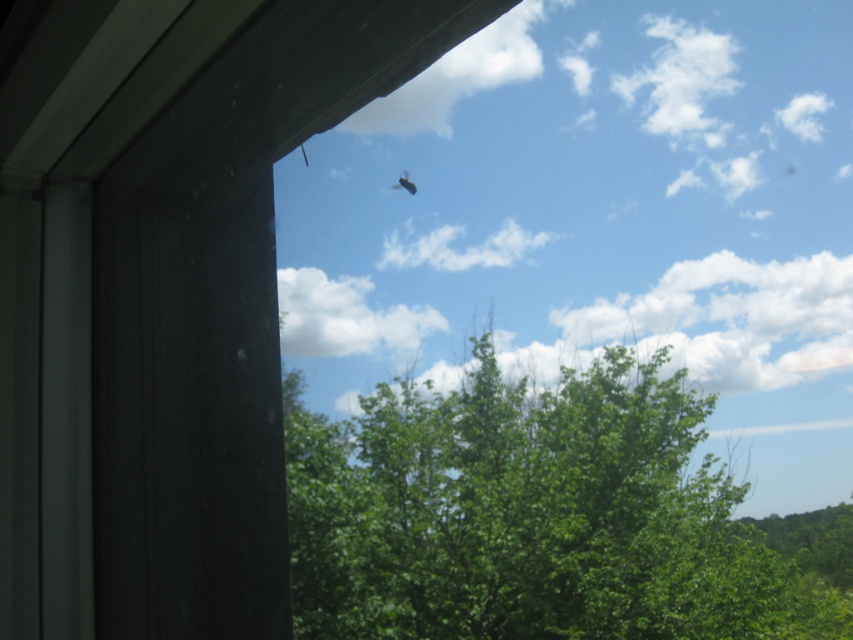
You are an ornithologist observing birds in a park. You see a black matte bird at upper center and a green leafy tree at center. Which object is wider?

The green leafy tree at center is wider than the black matte bird at upper center.

You are standing inside a room looking through the window. You see the green leafy tree at center and the black matte bird at upper center. Which object is closer to the left side of the window?

The black matte bird at upper center is closer to the left side of the window because the green leafy tree at center is positioned on the right side of it.

You are looking through a window and see a point marked at coordinates (544, 515). Based on the scene, where is this point located?

The point is located on the green leafy tree at center.